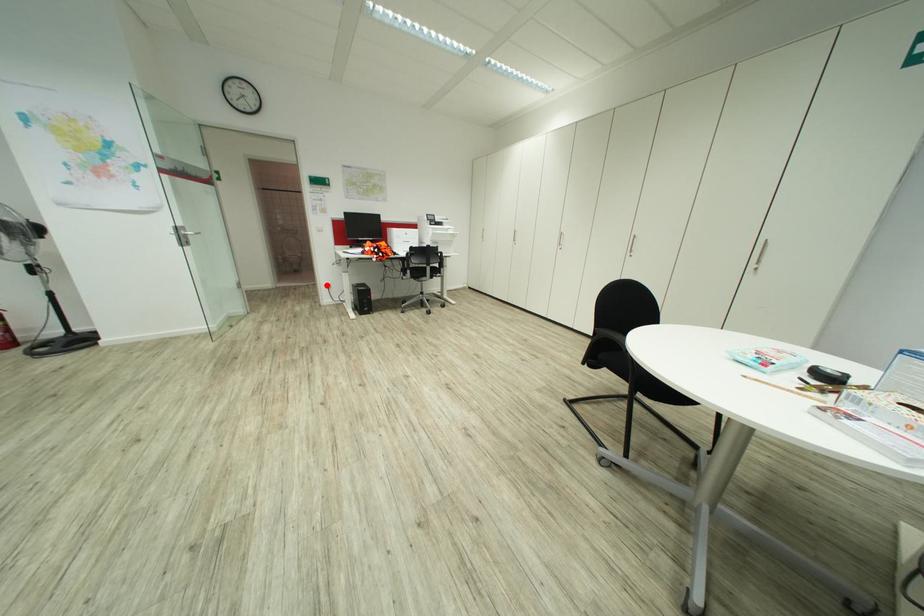
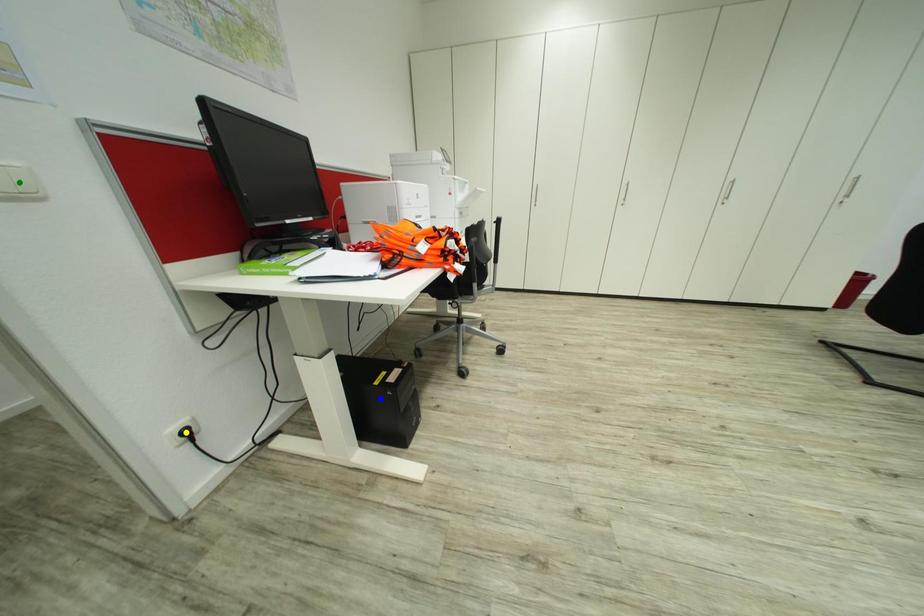
Question: I am providing you with two images of the same scene from different viewpoints. A red point is marked on the first image. You are given multiple points on the second image. Which mark in image 2 goes with the point in image 1?

Choices:
 (A) blue point
 (B) green point
 (C) yellow point

Answer: (C)